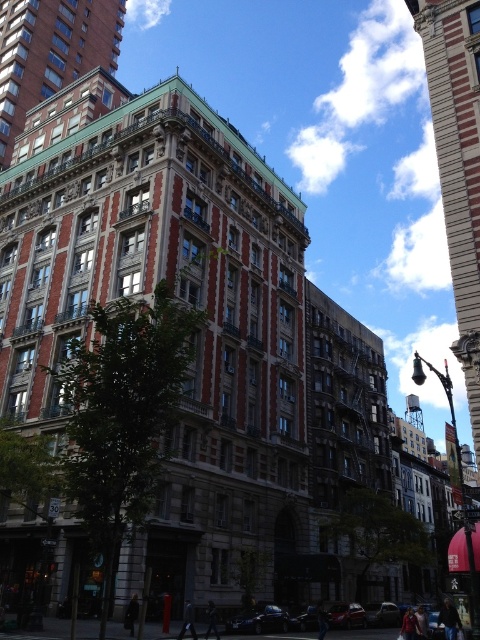
Question: Is brown stone building at center behind stone textured building at right?

Choices:
 (A) yes
 (B) no

Answer: (A)

Question: Is stone textured building at right thinner than red brick building at upper left?

Choices:
 (A) yes
 (B) no

Answer: (B)

Question: Among these objects, which one is nearest to the camera?

Choices:
 (A) brown stone building at center
 (B) stone textured building at right
 (C) red brick building at upper left

Answer: (B)

Question: Based on their relative distances, which object is farther from the brown stone building at center?

Choices:
 (A) red brick building at upper left
 (B) stone textured building at right

Answer: (A)

Question: Does stone textured building at right have a larger size compared to red brick building at upper left?

Choices:
 (A) yes
 (B) no

Answer: (A)

Question: Estimate the real-world distances between objects in this image. Which object is closer to the brown stone building at center?

Choices:
 (A) stone textured building at right
 (B) red brick building at upper left

Answer: (A)